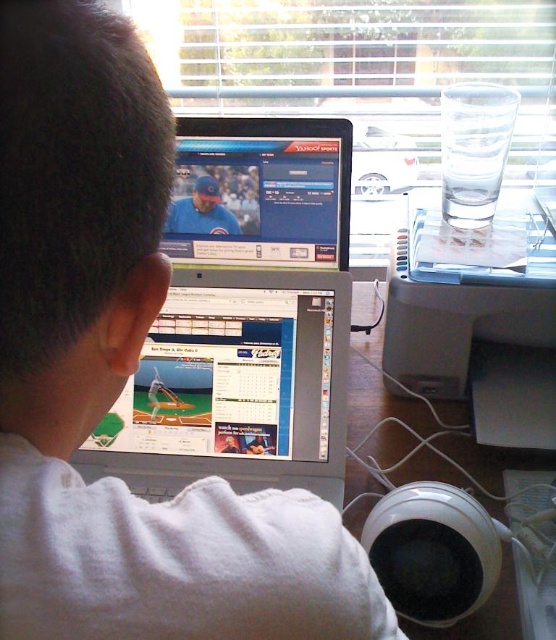
Question: Is silver metallic laptop at center positioned behind transparent plastic printer at upper right?

Choices:
 (A) no
 (B) yes

Answer: (A)

Question: Does silver metallic laptop at center appear under matte black monitor at upper center?

Choices:
 (A) no
 (B) yes

Answer: (B)

Question: Is transparent plastic printer at upper right above matte black monitor at upper center?

Choices:
 (A) yes
 (B) no

Answer: (B)

Question: Based on their relative distances, which object is nearer to the silver metallic laptop at center?

Choices:
 (A) matte black monitor at upper center
 (B) transparent plastic printer at upper right

Answer: (A)

Question: Which is farther from the silver metallic laptop at center?

Choices:
 (A) transparent plastic printer at upper right
 (B) matte black monitor at upper center

Answer: (A)

Question: Which of the following is the farthest from the observer?

Choices:
 (A) (325, 403)
 (B) (344, 216)
 (C) (518, 262)

Answer: (C)